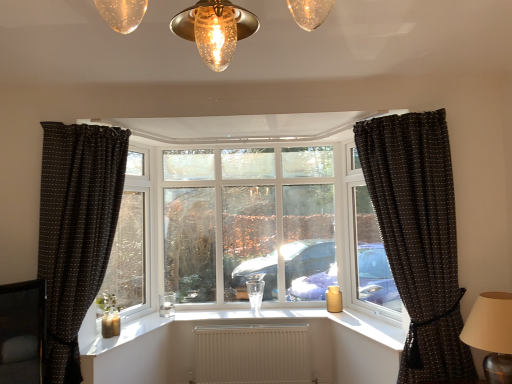
Find the location of `black dotted fabric curtain at right, which appears as the first curtain when viewed from the right`. black dotted fabric curtain at right, which appears as the first curtain when viewed from the right is located at coordinates (419, 238).

The image size is (512, 384). In order to click on white textured radiator at center in this screenshot , I will do `click(252, 354)`.

Describe the element at coordinates (252, 354) in the screenshot. I see `white textured radiator at center` at that location.

Image resolution: width=512 pixels, height=384 pixels. What do you see at coordinates (131, 242) in the screenshot? I see `clear glass window at left, arranged as the 2th window frame when viewed from the right` at bounding box center [131, 242].

Where is `black dotted fabric curtain at left, the first curtain in the left-to-right sequence`? The width and height of the screenshot is (512, 384). black dotted fabric curtain at left, the first curtain in the left-to-right sequence is located at coordinates (76, 230).

Is black dotted fabric curtain at right, which appears as the first curtain when viewed from the right, oriented away from clear glass window at center?

That's not correct — black dotted fabric curtain at right, which appears as the first curtain when viewed from the right, is not looking away from clear glass window at center.

Considering the positions of objects black dotted fabric curtain at right, the 2th curtain positioned from the left, and clear glass window at center in the image provided, who is more to the right, black dotted fabric curtain at right, the 2th curtain positioned from the left, or clear glass window at center?

black dotted fabric curtain at right, the 2th curtain positioned from the left, is more to the right.

Is clear glass window at center a part of black dotted fabric curtain at right, the 2th curtain positioned from the left?

No, clear glass window at center is not surrounded by black dotted fabric curtain at right, the 2th curtain positioned from the left.

Considering the relative sizes of black dotted fabric curtain at right, the 2th curtain positioned from the left, and clear glass window at center in the image provided, is black dotted fabric curtain at right, the 2th curtain positioned from the left, bigger than clear glass window at center?

Correct, black dotted fabric curtain at right, the 2th curtain positioned from the left, is larger in size than clear glass window at center.

Is clear glass window at left, which ranks as the first window frame in left-to-right order, next to clear glass window at center and touching it?

They are not placed beside each other.

Considering the relative positions of clear glass window at left, which ranks as the first window frame in left-to-right order, and clear glass window at center in the image provided, is clear glass window at left, which ranks as the first window frame in left-to-right order, to the left or to the right of clear glass window at center?

clear glass window at left, which ranks as the first window frame in left-to-right order, is positioned on clear glass window at center's left side.

Which of these two, clear glass window at left, arranged as the 2th window frame when viewed from the right, or clear glass window at center, stands taller?

clear glass window at left, arranged as the 2th window frame when viewed from the right, is taller.

Based on the photo, does clear glass window at left, arranged as the 2th window frame when viewed from the right, come behind clear glass window at center?

No, clear glass window at left, arranged as the 2th window frame when viewed from the right, is closer to the camera.

From the picture: Could you tell me if clear glass window at center is facing clear glass window at left, arranged as the 2th window frame when viewed from the right?

Yes, clear glass window at center is oriented towards clear glass window at left, arranged as the 2th window frame when viewed from the right.

Can you confirm if clear glass window at center is shorter than clear glass window at left, which ranks as the first window frame in left-to-right order?

Indeed, clear glass window at center has a lesser height compared to clear glass window at left, which ranks as the first window frame in left-to-right order.

From a real-world perspective, who is located higher, clear glass window at center or clear glass window at left, which ranks as the first window frame in left-to-right order?

clear glass window at center.

From the image's perspective, who appears lower, clear glass window at center or clear glass window at left, arranged as the 2th window frame when viewed from the right?

clear glass window at left, arranged as the 2th window frame when viewed from the right.

Which point is more distant from viewer, (495, 303) or (166, 311)?

The point (166, 311) is behind.

Would you say matte silver candle holder at center is part of matte brown table lamp at right's contents?

Actually, matte silver candle holder at center is outside matte brown table lamp at right.

What's the angular difference between matte brown table lamp at right and matte silver candle holder at center's facing directions?

There is a 94-degree angle between the facing directions of matte brown table lamp at right and matte silver candle holder at center.

From a real-world perspective, between matte brown table lamp at right and matte silver candle holder at center, who is vertically lower?

matte silver candle holder at center is physically lower.

Is matte brown table lamp at right shorter than clear glass window at left, arranged as the 2th window frame when viewed from the right?

Correct, matte brown table lamp at right is not as tall as clear glass window at left, arranged as the 2th window frame when viewed from the right.

Considering the sizes of objects matte brown table lamp at right and clear glass window at left, which ranks as the first window frame in left-to-right order, in the image provided, who is wider, matte brown table lamp at right or clear glass window at left, which ranks as the first window frame in left-to-right order,?

matte brown table lamp at right.

Could you measure the distance between matte brown table lamp at right and clear glass window at left, arranged as the 2th window frame when viewed from the right?

They are 2.83 meters apart.

Is matte brown table lamp at right positioned before clear glass window at left, which ranks as the first window frame in left-to-right order?

Yes, it is in front of clear glass window at left, which ranks as the first window frame in left-to-right order.

At what (x,y) coordinates should I click in order to perform the action: click on window frame that is the 1st one when counting upward from the black dotted fabric curtain at right, which appears as the first curtain when viewed from the right (from the image's perspective). Please return your answer as a coordinate pair (x, y). Looking at the image, I should click on (131, 242).

Is black dotted fabric curtain at right, the 2th curtain positioned from the left, inside clear glass window at left, arranged as the 2th window frame when viewed from the right?

No, black dotted fabric curtain at right, the 2th curtain positioned from the left, is not surrounded by clear glass window at left, arranged as the 2th window frame when viewed from the right.

Which of these two, clear glass window at left, arranged as the 2th window frame when viewed from the right, or black dotted fabric curtain at right, which appears as the first curtain when viewed from the right, is thinner?

Thinner between the two is clear glass window at left, arranged as the 2th window frame when viewed from the right.

From the image's perspective, which object appears higher, clear glass window at left, arranged as the 2th window frame when viewed from the right, or black dotted fabric curtain at right, the 2th curtain positioned from the left?

clear glass window at left, arranged as the 2th window frame when viewed from the right, is shown above in the image.

From a real-world perspective, is clear glass window at right, the 2th window frame in the left-to-right sequence, physically above clear glass window at center?

No, from a real-world perspective, clear glass window at right, the 2th window frame in the left-to-right sequence, is not over clear glass window at center

Is clear glass window at right, the 2th window frame in the left-to-right sequence, not near clear glass window at center?

No, clear glass window at right, the 2th window frame in the left-to-right sequence, is not far away from clear glass window at center.

Looking at this image, is clear glass window at right, the 2th window frame in the left-to-right sequence, to the left or to the right of clear glass window at center in the image?

clear glass window at right, the 2th window frame in the left-to-right sequence, is to the right of clear glass window at center.

What's the angular difference between clear glass window at right, the 2th window frame in the left-to-right sequence, and clear glass window at center's facing directions?

They differ by 71.5 degrees in their facing directions.

This screenshot has height=384, width=512. What are the coordinates of `window screen above the black dotted fabric curtain at right, the 2th curtain positioned from the left (from the image's perspective)` in the screenshot? It's located at (249, 223).

Image resolution: width=512 pixels, height=384 pixels. Find the location of `window frame on the left side of clear glass window at center`. window frame on the left side of clear glass window at center is located at coordinates (131, 242).

Consider the image. Estimate the real-world distances between objects in this image. Which object is closer to matte brown table lamp at right, matte silver candle holder at center or white textured radiator at center?

white textured radiator at center is positioned closer to the anchor matte brown table lamp at right.

Based on their spatial positions, is clear glass window at left, which ranks as the first window frame in left-to-right order, or white textured radiator at center further from matte brown table lamp at right?

clear glass window at left, which ranks as the first window frame in left-to-right order, lies further to matte brown table lamp at right than the other object.

Looking at the image, which one is located further to clear glass window at center, clear glass window at left, arranged as the 2th window frame when viewed from the right, or clear glass window at right, the first window frame from the right?

Based on the image, clear glass window at right, the first window frame from the right, appears to be further to clear glass window at center.

Estimate the real-world distances between objects in this image. Which object is further from clear glass window at right, the first window frame from the right, matte brown table lamp at right or clear glass window at center?

The object further to clear glass window at right, the first window frame from the right, is matte brown table lamp at right.

Which object lies further to the anchor point matte brown table lamp at right, clear glass window at center or clear glass window at left, which ranks as the first window frame in left-to-right order?

Based on the image, clear glass window at left, which ranks as the first window frame in left-to-right order, appears to be further to matte brown table lamp at right.

Based on their spatial positions, is white textured radiator at center or matte brown table lamp at right closer to clear glass window at center?

white textured radiator at center lies closer to clear glass window at center than the other object.

Which object lies further to the anchor point white textured radiator at center, matte silver candle holder at center or clear glass window at center?

matte silver candle holder at center lies further to white textured radiator at center than the other object.

Which object lies further to the anchor point matte silver candle holder at center, white textured radiator at center or clear glass window at right, the first window frame from the right?

Based on the image, clear glass window at right, the first window frame from the right, appears to be further to matte silver candle holder at center.

You are a GUI agent. You are given a task and a screenshot of the screen. Output one action in this format:
    pyautogui.click(x=<x>, y=<y>)
    Task: Click on the window screen situated between clear glass window at left, arranged as the 2th window frame when viewed from the right, and clear glass window at right, the first window frame from the right, from left to right
    The image size is (512, 384).
    Given the screenshot: What is the action you would take?
    pyautogui.click(x=249, y=223)

The image size is (512, 384). What are the coordinates of `window frame between black dotted fabric curtain at left, the first curtain in the left-to-right sequence, and white textured radiator at center from left to right` in the screenshot? It's located at (131, 242).

You are a GUI agent. You are given a task and a screenshot of the screen. Output one action in this format:
    pyautogui.click(x=<x>, y=<y>)
    Task: Click on the window frame between matte silver candle holder at center and matte brown table lamp at right in the horizontal direction
    
    Given the screenshot: What is the action you would take?
    pyautogui.click(x=373, y=261)

You are a GUI agent. You are given a task and a screenshot of the screen. Output one action in this format:
    pyautogui.click(x=<x>, y=<y>)
    Task: Click on the curtain located between white textured radiator at center and matte brown table lamp at right in the left-right direction
    Image resolution: width=512 pixels, height=384 pixels.
    Given the screenshot: What is the action you would take?
    pyautogui.click(x=419, y=238)